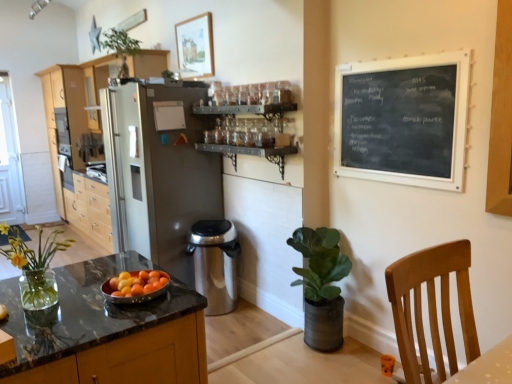
Question: Are marble countertop at lower left and wooden picture frame at upper center making contact?

Choices:
 (A) no
 (B) yes

Answer: (A)

Question: Does marble countertop at lower left turn towards wooden picture frame at upper center?

Choices:
 (A) no
 (B) yes

Answer: (A)

Question: Is marble countertop at lower left wider than wooden picture frame at upper center?

Choices:
 (A) yes
 (B) no

Answer: (A)

Question: Is marble countertop at lower left further to camera compared to wooden picture frame at upper center?

Choices:
 (A) no
 (B) yes

Answer: (A)

Question: From the image's perspective, would you say marble countertop at lower left is positioned over wooden picture frame at upper center?

Choices:
 (A) no
 (B) yes

Answer: (A)

Question: Is marble countertop at lower left turned away from wooden picture frame at upper center?

Choices:
 (A) no
 (B) yes

Answer: (A)

Question: Does black chalkboard at upper right have a greater width compared to green leafy plant at upper center, which is counted as the first houseplant, starting from the top?

Choices:
 (A) yes
 (B) no

Answer: (B)

Question: Considering the relative sizes of black chalkboard at upper right and green leafy plant at upper center, the 1th houseplant from the left, in the image provided, is black chalkboard at upper right smaller than green leafy plant at upper center, the 1th houseplant from the left,?

Choices:
 (A) no
 (B) yes

Answer: (B)

Question: Is black chalkboard at upper right further to the viewer compared to green leafy plant at upper center, the 1th houseplant from the left?

Choices:
 (A) yes
 (B) no

Answer: (B)

Question: Does black chalkboard at upper right have a greater height compared to green leafy plant at upper center, placed as the 3th houseplant when sorted from right to left?

Choices:
 (A) no
 (B) yes

Answer: (B)

Question: From the image's perspective, is black chalkboard at upper right over green leafy plant at upper center, the 3th houseplant positioned from the bottom?

Choices:
 (A) no
 (B) yes

Answer: (A)

Question: Are black chalkboard at upper right and green leafy plant at upper center, the third houseplant viewed from the front, far apart?

Choices:
 (A) yes
 (B) no

Answer: (A)

Question: Is light brown wood cabinets at left taller than marble countertop at lower left?

Choices:
 (A) no
 (B) yes

Answer: (B)